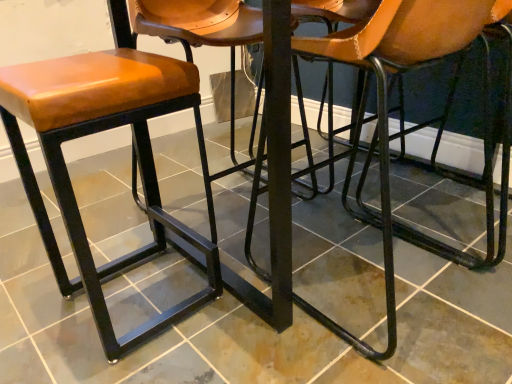
Question: Should I look upward or downward to see matte black stool at center?

Choices:
 (A) up
 (B) down

Answer: (B)

Question: Is matte brown leather stool at left thinner than matte black stool at center?

Choices:
 (A) no
 (B) yes

Answer: (B)

Question: Is matte brown leather stool at left wider than matte black stool at center?

Choices:
 (A) yes
 (B) no

Answer: (B)

Question: From a real-world perspective, is matte brown leather stool at left under matte black stool at center?

Choices:
 (A) yes
 (B) no

Answer: (B)

Question: Is matte brown leather stool at left at the left side of matte black stool at center?

Choices:
 (A) yes
 (B) no

Answer: (A)

Question: Is matte brown leather stool at left positioned in front of matte black stool at center?

Choices:
 (A) no
 (B) yes

Answer: (A)

Question: Does matte brown leather stool at left contain matte black stool at center?

Choices:
 (A) no
 (B) yes

Answer: (A)

Question: Can you confirm if matte brown leather stool at left is thinner than brown leather chair at center?

Choices:
 (A) yes
 (B) no

Answer: (A)

Question: From a real-world perspective, is matte brown leather stool at left under brown leather chair at center?

Choices:
 (A) no
 (B) yes

Answer: (B)

Question: Considering the relative positions of matte brown leather stool at left and brown leather chair at center in the image provided, is matte brown leather stool at left behind brown leather chair at center?

Choices:
 (A) no
 (B) yes

Answer: (B)

Question: Would you consider matte brown leather stool at left to be distant from brown leather chair at center?

Choices:
 (A) no
 (B) yes

Answer: (A)

Question: Can you confirm if matte brown leather stool at left is bigger than brown leather chair at center?

Choices:
 (A) no
 (B) yes

Answer: (A)

Question: Could you tell me if matte brown leather stool at left is turned towards brown leather chair at center?

Choices:
 (A) no
 (B) yes

Answer: (A)

Question: Is matte brown leather stool at left a part of brown leather chair at center?

Choices:
 (A) no
 (B) yes

Answer: (A)